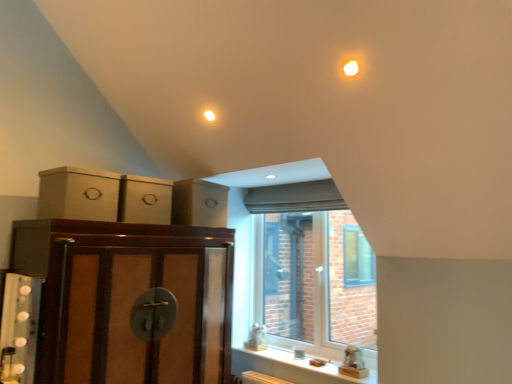
Question: Does brown wood cabinet at left, marked as the 1th cabinetry in a bottom-to-top arrangement, have a lesser height compared to matte cardboard drawer at upper left?

Choices:
 (A) yes
 (B) no

Answer: (B)

Question: Considering the relative sizes of brown wood cabinet at left, positioned as the third cabinetry in top-to-bottom order, and matte cardboard drawer at upper left in the image provided, is brown wood cabinet at left, positioned as the third cabinetry in top-to-bottom order, thinner than matte cardboard drawer at upper left?

Choices:
 (A) yes
 (B) no

Answer: (B)

Question: From a real-world perspective, is brown wood cabinet at left, marked as the 1th cabinetry in a bottom-to-top arrangement, physically below matte cardboard drawer at upper left?

Choices:
 (A) yes
 (B) no

Answer: (A)

Question: Does brown wood cabinet at left, marked as the 1th cabinetry in a bottom-to-top arrangement, come behind matte cardboard drawer at upper left?

Choices:
 (A) yes
 (B) no

Answer: (B)

Question: Is matte cardboard drawer at upper left inside or outside of clear glass window at center?

Choices:
 (A) inside
 (B) outside

Answer: (B)

Question: Is matte cardboard drawer at upper left in front of or behind clear glass window at center in the image?

Choices:
 (A) front
 (B) behind

Answer: (A)

Question: Considering the positions of point (207, 187) and point (324, 301), is point (207, 187) closer or farther from the camera than point (324, 301)?

Choices:
 (A) closer
 (B) farther

Answer: (A)

Question: Is matte cardboard drawer at upper left to the left or to the right of clear glass window at center in the image?

Choices:
 (A) left
 (B) right

Answer: (A)

Question: Looking at their shapes, would you say brown wood cabinet at left, positioned as the third cabinetry in top-to-bottom order, is wider or thinner than brown cardboard boxes at upper left, the 2th cabinetry from the bottom?

Choices:
 (A) wide
 (B) thin

Answer: (A)

Question: Considering the positions of point (73, 377) and point (120, 203), is point (73, 377) closer or farther from the camera than point (120, 203)?

Choices:
 (A) farther
 (B) closer

Answer: (B)

Question: From a real-world perspective, is brown wood cabinet at left, positioned as the third cabinetry in top-to-bottom order, positioned above or below brown cardboard boxes at upper left, which ranks as the second cabinetry in top-to-bottom order?

Choices:
 (A) below
 (B) above

Answer: (A)

Question: Looking at the image, does brown wood cabinet at left, positioned as the third cabinetry in top-to-bottom order, seem bigger or smaller compared to brown cardboard boxes at upper left, the 2th cabinetry from the bottom?

Choices:
 (A) big
 (B) small

Answer: (A)

Question: From their relative heights in the image, would you say brown wood cabinet at left, marked as the 1th cabinetry in a bottom-to-top arrangement, is taller or shorter than matte cardboard drawer at upper left?

Choices:
 (A) tall
 (B) short

Answer: (A)

Question: In terms of size, does brown wood cabinet at left, positioned as the third cabinetry in top-to-bottom order, appear bigger or smaller than matte cardboard drawer at upper left?

Choices:
 (A) big
 (B) small

Answer: (A)